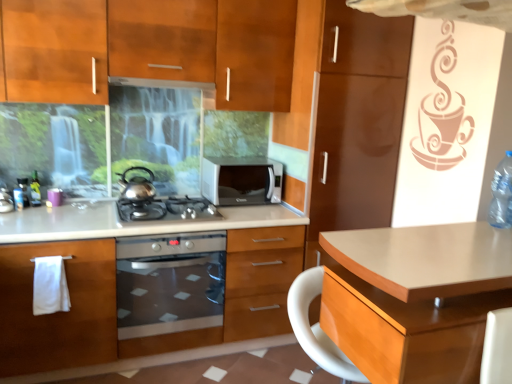
Where is `free point below satin silver microwave at center (from a real-world perspective)`? free point below satin silver microwave at center (from a real-world perspective) is located at coordinates (238, 204).